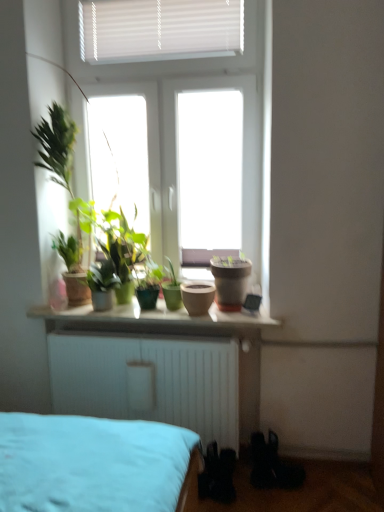
You are a GUI agent. You are given a task and a screenshot of the screen. Output one action in this format:
    pyautogui.click(x=<x>, y=<y>)
    Task: Click on the free spot in front of matte brown pot at center, the second flowerpot positioned from the left
    The height and width of the screenshot is (512, 384).
    Given the screenshot: What is the action you would take?
    pyautogui.click(x=238, y=317)